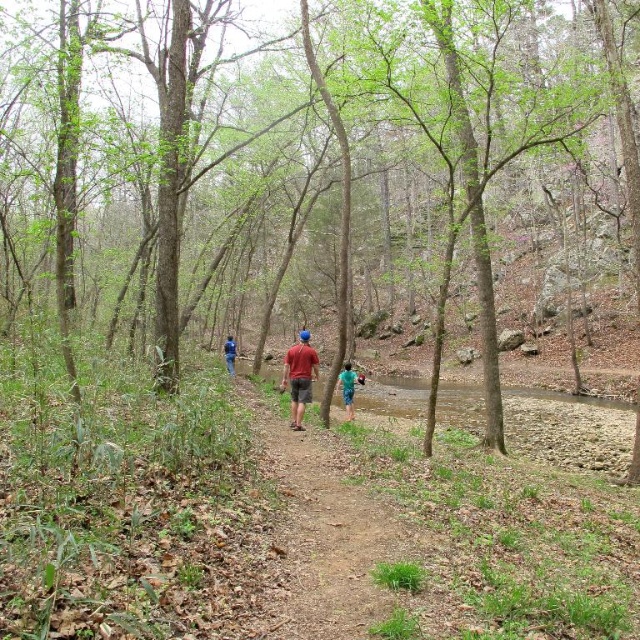
Looking at this image, can you confirm if brown wood tree at center is positioned below green fabric shorts at center?

No.

The image size is (640, 640). I want to click on brown wood tree at center, so (291, 160).

Which is more to the right, brown dirt path at center or green fabric shorts at center?

green fabric shorts at center

Does brown dirt path at center appear on the left side of green fabric shorts at center?

Yes, brown dirt path at center is to the left of green fabric shorts at center.

Between point (349, 561) and point (348, 371), which one is positioned behind?

Point (348, 371)

Locate an element on the screen. Image resolution: width=640 pixels, height=640 pixels. brown dirt path at center is located at coordinates (330, 531).

Is brown wood tree at center below blue denim jeans at center?

No.

Is brown wood tree at center shorter than blue denim jeans at center?

Incorrect, brown wood tree at center's height does not fall short of blue denim jeans at center's.

This screenshot has height=640, width=640. I want to click on brown wood tree at center, so click(291, 160).